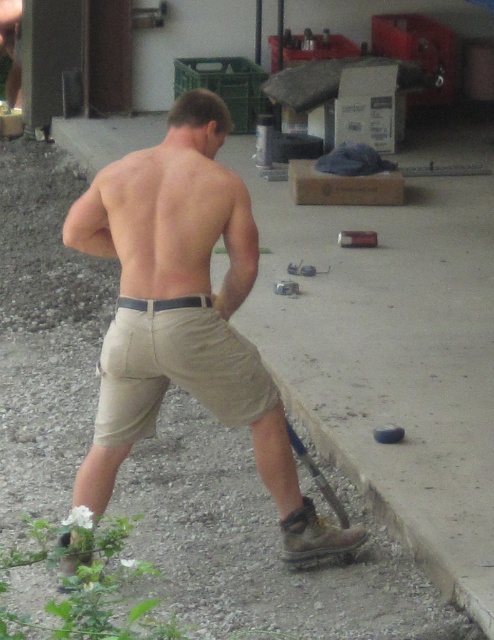
You are the man in the image and you need to move an object from point (119, 212) to point (169, 195). Which direction should you move it relative to your current position?

Point (119, 212) is behind point (169, 195), so you should move it forward relative to your current position facing away from the camera.

The man is standing on gravel with small plants nearby. There is a paved area to his right where an object is located at point (164,218). What is at that point?

Muscular tan skin at back is located at point (164,218).